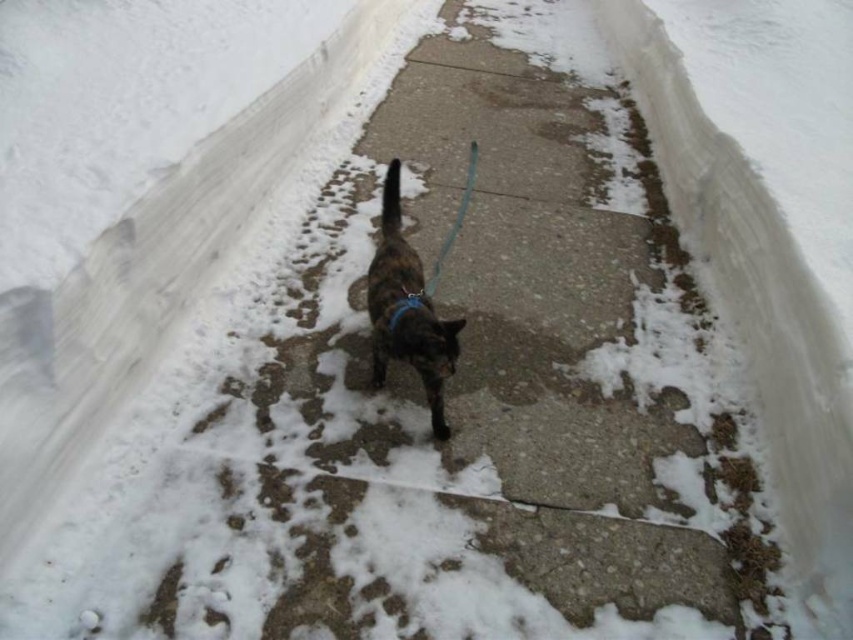
Question: Can you confirm if brown fur cat at center is positioned above teal fabric leash at center?

Choices:
 (A) yes
 (B) no

Answer: (B)

Question: Which point is farther from the camera taking this photo?

Choices:
 (A) (469, 154)
 (B) (386, 342)

Answer: (A)

Question: Which object appears farthest from the camera in this image?

Choices:
 (A) brown fur cat at center
 (B) teal fabric leash at center

Answer: (B)

Question: Does brown fur cat at center appear over teal fabric leash at center?

Choices:
 (A) no
 (B) yes

Answer: (A)

Question: Can you confirm if brown fur cat at center is positioned to the left of teal fabric leash at center?

Choices:
 (A) yes
 (B) no

Answer: (A)